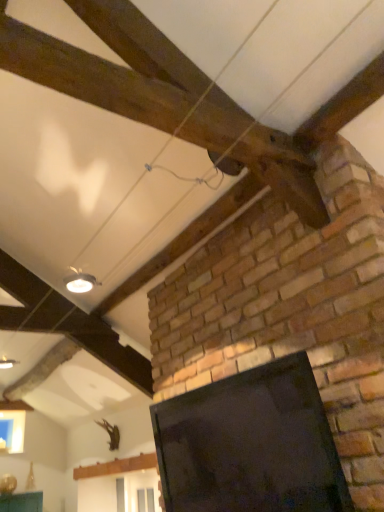
This screenshot has height=512, width=384. Describe the element at coordinates (80, 281) in the screenshot. I see `white glossy light fixture at upper left` at that location.

Where is `white glossy light fixture at upper left`? This screenshot has height=512, width=384. white glossy light fixture at upper left is located at coordinates pyautogui.click(x=80, y=281).

Find the location of `black glossy screen at center`. black glossy screen at center is located at coordinates (250, 444).

Describe the element at coordinates (250, 444) in the screenshot. I see `black glossy screen at center` at that location.

Where is `white glossy light fixture at upper left`? The height and width of the screenshot is (512, 384). white glossy light fixture at upper left is located at coordinates (80, 281).

Which object is positioned more to the right, black glossy screen at center or white glossy light fixture at upper left?

Positioned to the right is black glossy screen at center.

Considering their positions, is black glossy screen at center located in front of or behind white glossy light fixture at upper left?

Visually, black glossy screen at center is located in front of white glossy light fixture at upper left.

Between point (290, 416) and point (92, 284), which one is positioned behind?

Point (92, 284)

From the image's perspective, would you say black glossy screen at center is shown under white glossy light fixture at upper left?

Yes, from the image's perspective, black glossy screen at center is below white glossy light fixture at upper left.

From a real-world perspective, is black glossy screen at center over white glossy light fixture at upper left?

No, from a real-world perspective, black glossy screen at center is not on top of white glossy light fixture at upper left.

Between black glossy screen at center and white glossy light fixture at upper left, which one has larger width?

black glossy screen at center is wider.

Considering the relative sizes of black glossy screen at center and white glossy light fixture at upper left in the image provided, is black glossy screen at center taller than white glossy light fixture at upper left?

Indeed, black glossy screen at center has a greater height compared to white glossy light fixture at upper left.

Does black glossy screen at center have a smaller size compared to white glossy light fixture at upper left?

Incorrect, black glossy screen at center is not smaller in size than white glossy light fixture at upper left.

Do you think black glossy screen at center is within white glossy light fixture at upper left, or outside of it?

black glossy screen at center is outside white glossy light fixture at upper left.

Is black glossy screen at center not close to white glossy light fixture at upper left?

Yes, black glossy screen at center is far from white glossy light fixture at upper left.

Is black glossy screen at center aimed at white glossy light fixture at upper left?

No, black glossy screen at center does not turn towards white glossy light fixture at upper left.

What's the angular difference between black glossy screen at center and white glossy light fixture at upper left's facing directions?

black glossy screen at center and white glossy light fixture at upper left are facing 89.4 degrees away from each other.

There is a black glossy screen at center. In order to click on light fixture above it (from a real-world perspective) in this screenshot , I will do `click(80, 281)`.

From the picture: Can you confirm if white glossy light fixture at upper left is positioned to the right of black glossy screen at center?

In fact, white glossy light fixture at upper left is to the left of black glossy screen at center.

Considering the relative positions of white glossy light fixture at upper left and black glossy screen at center in the image provided, is white glossy light fixture at upper left behind black glossy screen at center?

Yes.

Which is closer to the camera, (71, 282) or (275, 405)?

Point (71, 282) appears to be farther away from the viewer than point (275, 405).

From the image's perspective, which one is positioned lower, white glossy light fixture at upper left or black glossy screen at center?

black glossy screen at center appears lower in the image.

From a real-world perspective, between white glossy light fixture at upper left and black glossy screen at center, who is vertically lower?

black glossy screen at center, from a real-world perspective.

Between white glossy light fixture at upper left and black glossy screen at center, which one has larger width?

With larger width is black glossy screen at center.

Which of these two, white glossy light fixture at upper left or black glossy screen at center, stands taller?

black glossy screen at center is taller.

Based on the photo, looking at the image, does white glossy light fixture at upper left seem bigger or smaller compared to black glossy screen at center?

Clearly, white glossy light fixture at upper left is smaller in size than black glossy screen at center.

Would you say white glossy light fixture at upper left contains black glossy screen at center?

Definitely not — black glossy screen at center is not inside white glossy light fixture at upper left.

Are white glossy light fixture at upper left and black glossy screen at center beside each other?

No, white glossy light fixture at upper left is not touching black glossy screen at center.

Is white glossy light fixture at upper left aimed at black glossy screen at center?

No, white glossy light fixture at upper left is not aimed at black glossy screen at center.

How different are the orientations of white glossy light fixture at upper left and black glossy screen at center in degrees?

The angle between the facing direction of white glossy light fixture at upper left and the facing direction of black glossy screen at center is 89.4 degrees.

In the image, there is a black glossy screen at center. Where is `light fixture above it (from the image's perspective)`? light fixture above it (from the image's perspective) is located at coordinates (80, 281).

Locate an element on the screen. light fixture located behind the black glossy screen at center is located at coordinates (80, 281).

In the image, there is a black glossy screen at center. Where is `light fixture above it (from the image's perspective)`? The height and width of the screenshot is (512, 384). light fixture above it (from the image's perspective) is located at coordinates (80, 281).